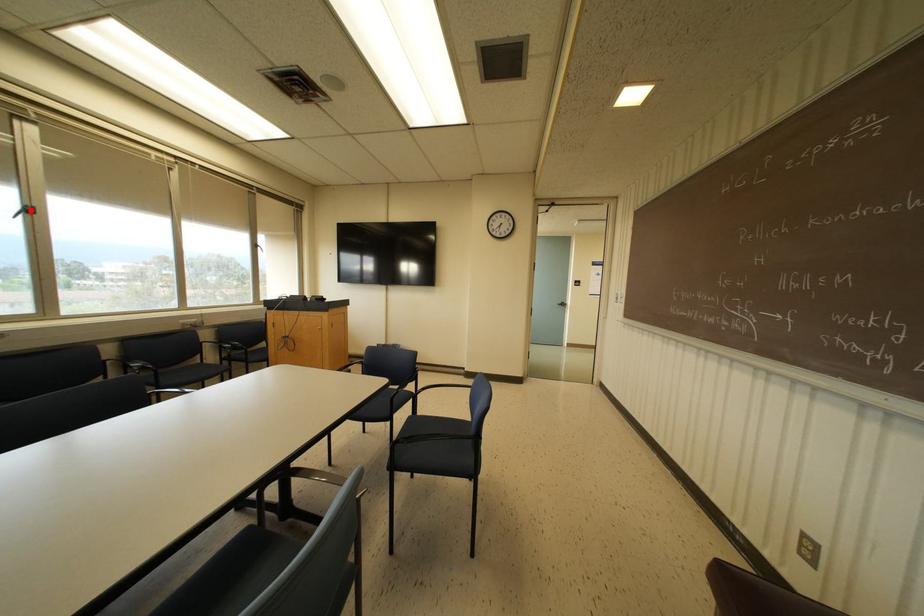
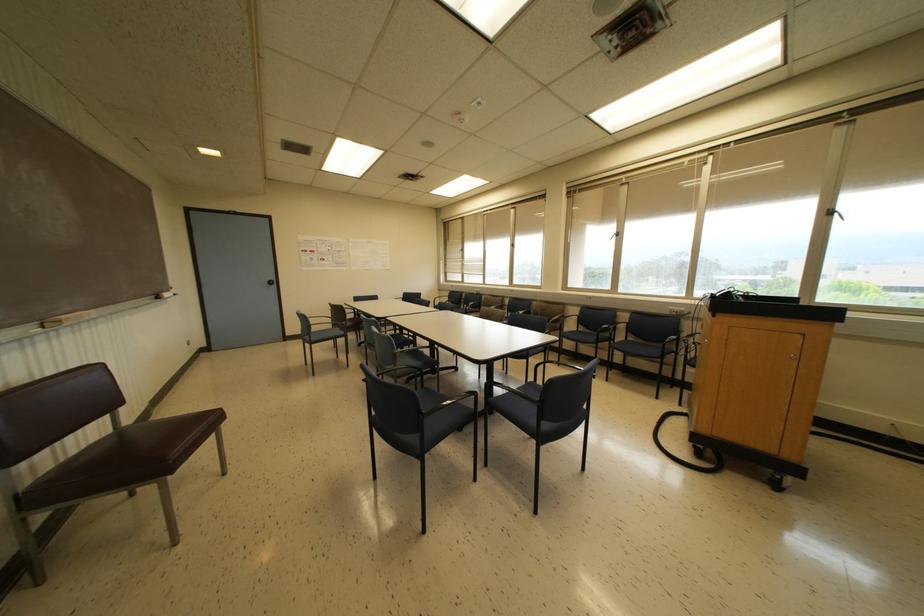
The point at the highlighted location is marked in the first image. Where is the corresponding point in the second image?

(617, 233)